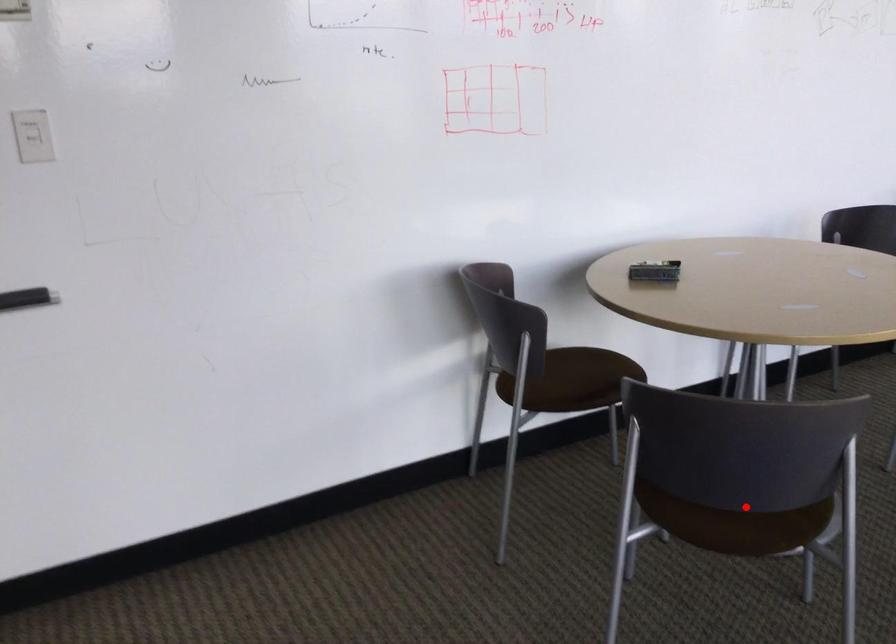
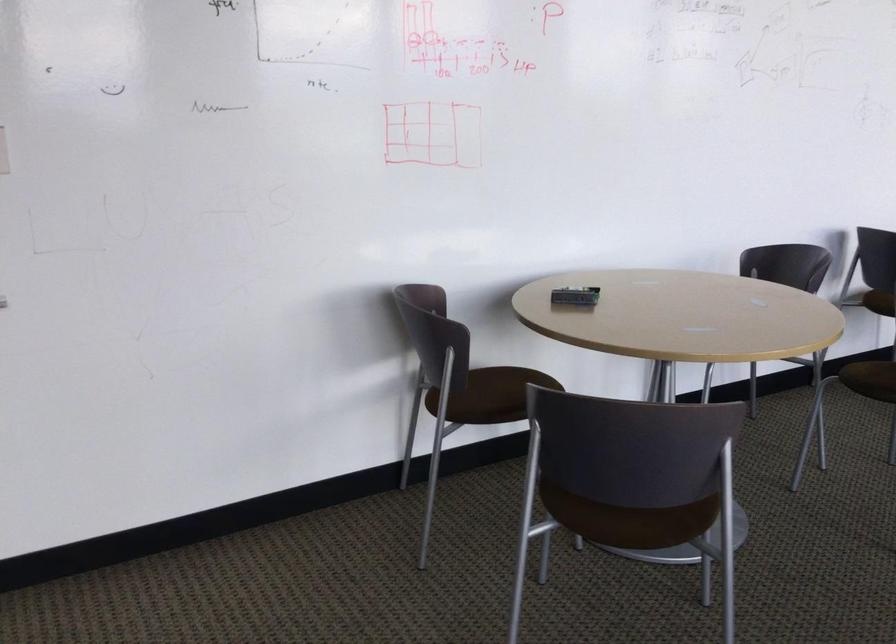
Find the pixel in the second image that matches the highlighted location in the first image.

(633, 505)